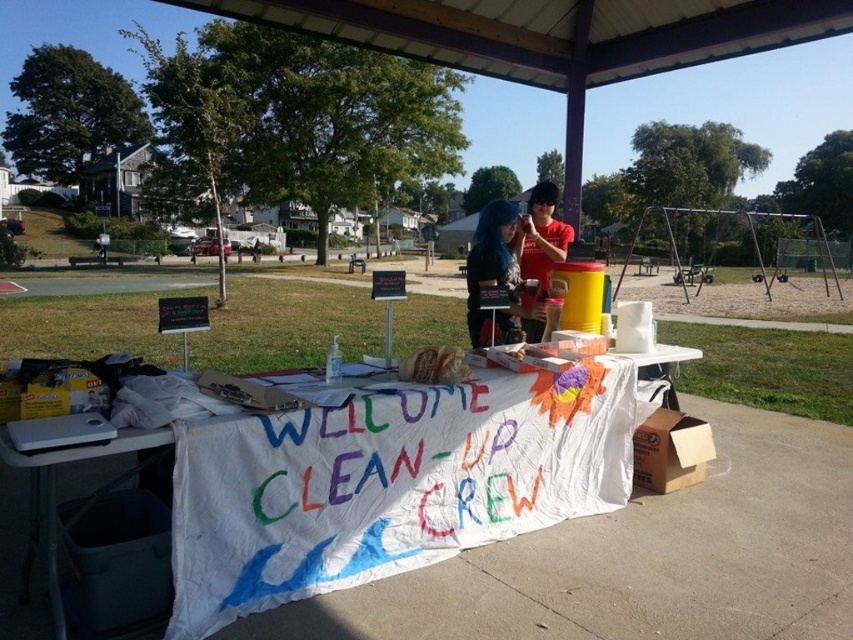
You are a participant at an outdoor event and notice the white cloth banner at center and the shiny blue hair at center. How far apart are these two items from each other?

The white cloth banner at center and the shiny blue hair at center are 3.46 feet apart.

You are standing at the camera position and want to reach the white cloth banner at center to adjust its position. Considering the distance between you and the banner, can you comfortably walk to it without needing to move any obstacles?

The distance between you and the white cloth banner at center is 6.55 feet, so yes, you can comfortably walk to it without needing to move any obstacles since the distance is manageable.

You are a volunteer at the clean up event. You need to place a new sign that is wider than the white cloth banner at center. Will the shiny blue hair at center fit under the new sign?

The white cloth banner at center is wider than the shiny blue hair at center. Since the new sign is wider than the banner, it will also be wider than the shiny blue hair at center, so the hair should fit under the new sign.